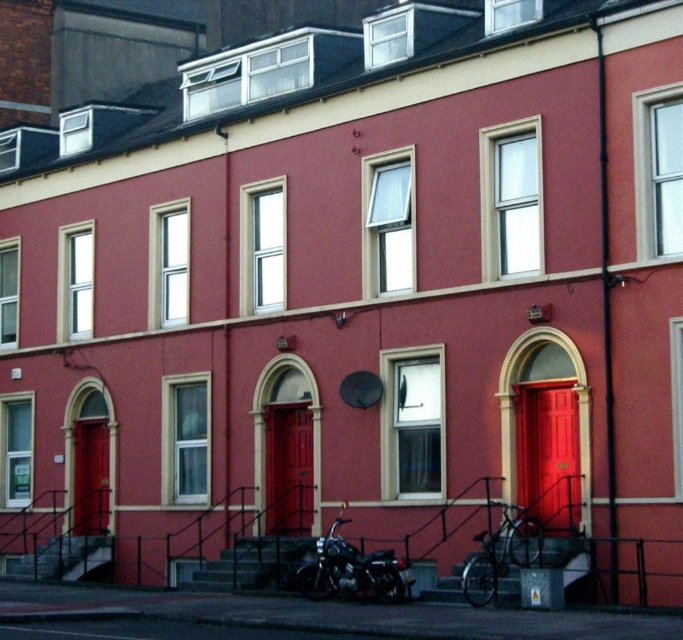
You are standing in front of the building and want to take a photo. You notice two points marked on the building. Which point is closer to your camera, point 1 at coordinates point (x=563, y=440) or point 2 at coordinates point (x=311, y=474)?

Point 1 at coordinates point (x=563, y=440) is closer to the camera than point 2 at coordinates point (x=311, y=474).

You are standing at the entrance of the building and want to locate the matte red door at center. According to the coordinates provided, where exactly is the matte red door located?

The matte red door at center is located at the coordinates point (288,468).

You are standing in front of the two story residential building. You see a point at coordinate (548,454). Where is this point located on the building?

The point at coordinate (548,454) is located on the matte red door at center right.